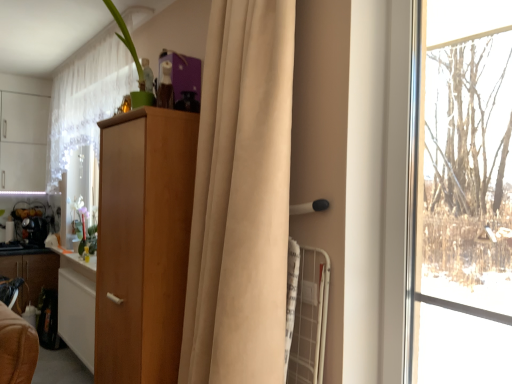
Question: From the image's perspective, is metallic silver kettle at left, marked as the 1th appliance in a back-to-front arrangement, beneath light brown wood cabinet at center, the 2th cabinetry from the left?

Choices:
 (A) no
 (B) yes

Answer: (A)

Question: Is metallic silver kettle at left, which is the 2th appliance from front to back, beside light brown wood cabinet at center, the 2th cabinetry viewed from the back?

Choices:
 (A) yes
 (B) no

Answer: (B)

Question: Can you confirm if metallic silver kettle at left, marked as the 1th appliance in a back-to-front arrangement, is positioned to the left of light brown wood cabinet at center, the first cabinetry in the front-to-back sequence?

Choices:
 (A) yes
 (B) no

Answer: (A)

Question: Is metallic silver kettle at left, marked as the 1th appliance in a back-to-front arrangement, closer to camera compared to light brown wood cabinet at center, the 2th cabinetry from the left?

Choices:
 (A) no
 (B) yes

Answer: (A)

Question: Is metallic silver kettle at left, marked as the 1th appliance in a back-to-front arrangement, oriented towards light brown wood cabinet at center, the first cabinetry in the front-to-back sequence?

Choices:
 (A) no
 (B) yes

Answer: (B)

Question: Is metallic silver kettle at left, marked as the 1th appliance in a back-to-front arrangement, facing away from light brown wood cabinet at center, the 2th cabinetry viewed from the back?

Choices:
 (A) yes
 (B) no

Answer: (B)

Question: Can you confirm if beige fabric curtain at center, positioned as the first curtain in right-to-left order, is taller than metallic silver kettle at left, marked as the 1th appliance in a back-to-front arrangement?

Choices:
 (A) yes
 (B) no

Answer: (A)

Question: Can you see beige fabric curtain at center, positioned as the 2th curtain in back-to-front order, touching metallic silver kettle at left, marked as the 1th appliance in a back-to-front arrangement?

Choices:
 (A) no
 (B) yes

Answer: (A)

Question: Considering the relative sizes of beige fabric curtain at center, positioned as the 1th curtain in front-to-back order, and metallic silver kettle at left, which is the 2th appliance from front to back, in the image provided, is beige fabric curtain at center, positioned as the 1th curtain in front-to-back order, wider than metallic silver kettle at left, which is the 2th appliance from front to back,?

Choices:
 (A) yes
 (B) no

Answer: (A)

Question: From a real-world perspective, is beige fabric curtain at center, positioned as the 1th curtain in front-to-back order, positioned under metallic silver kettle at left, marked as the 1th appliance in a back-to-front arrangement, based on gravity?

Choices:
 (A) no
 (B) yes

Answer: (A)

Question: Considering the relative sizes of beige fabric curtain at center, positioned as the 2th curtain in back-to-front order, and metallic silver kettle at left, which is the 2th appliance from front to back, in the image provided, is beige fabric curtain at center, positioned as the 2th curtain in back-to-front order, bigger than metallic silver kettle at left, which is the 2th appliance from front to back,?

Choices:
 (A) no
 (B) yes

Answer: (B)

Question: From the image's perspective, does beige fabric curtain at center, the second curtain viewed from the left, appear lower than metallic silver kettle at left, which is the 2th appliance from front to back?

Choices:
 (A) yes
 (B) no

Answer: (B)

Question: Considering the relative sizes of wooden cabinet at left, the 2th cabinetry positioned from the front, and light brown wood cabinet at center, the first cabinetry in the front-to-back sequence, in the image provided, is wooden cabinet at left, the 2th cabinetry positioned from the front, smaller than light brown wood cabinet at center, the first cabinetry in the front-to-back sequence,?

Choices:
 (A) no
 (B) yes

Answer: (B)